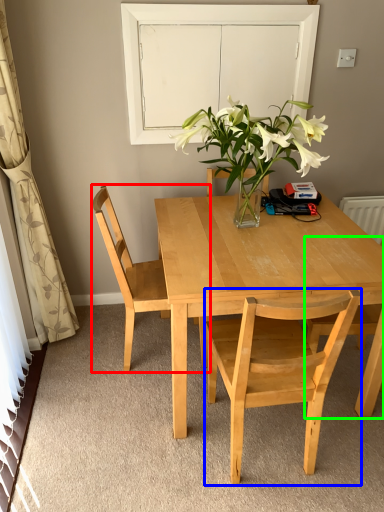
Question: Based on their relative distances, which object is nearer to chair (highlighted by a red box)? Choose from chair (highlighted by a blue box) and chair (highlighted by a green box).

Choices:
 (A) chair
 (B) chair

Answer: (A)